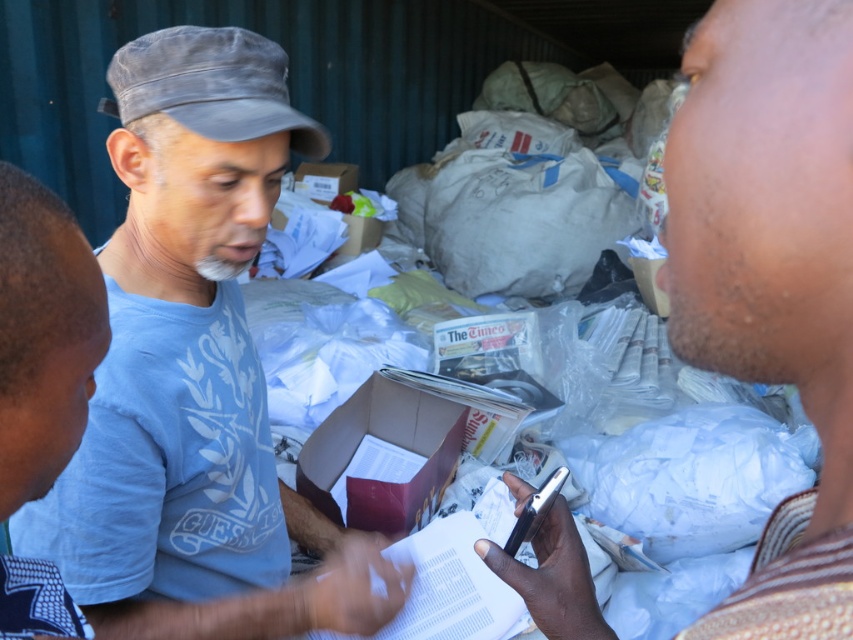
Question: Is light blue cotton shirt at center wider than smooth skin face at right?

Choices:
 (A) yes
 (B) no

Answer: (A)

Question: Which object is positioned closest to the smooth skin face at right?

Choices:
 (A) light blue cotton shirt at center
 (B) gray fabric baseball cap at upper left
 (C) cardboard box at center

Answer: (A)

Question: Is smooth skin face at right to the left of cardboard box at center from the viewer's perspective?

Choices:
 (A) no
 (B) yes

Answer: (A)

Question: Which object appears closest to the camera in this image?

Choices:
 (A) light blue cotton shirt at center
 (B) gray fabric baseball cap at upper left

Answer: (A)

Question: Is light blue cotton shirt at center to the left of cardboard box at center from the viewer's perspective?

Choices:
 (A) no
 (B) yes

Answer: (B)

Question: Among these objects, which one is farthest from the camera?

Choices:
 (A) gray fabric baseball cap at upper left
 (B) smooth skin face at right

Answer: (A)